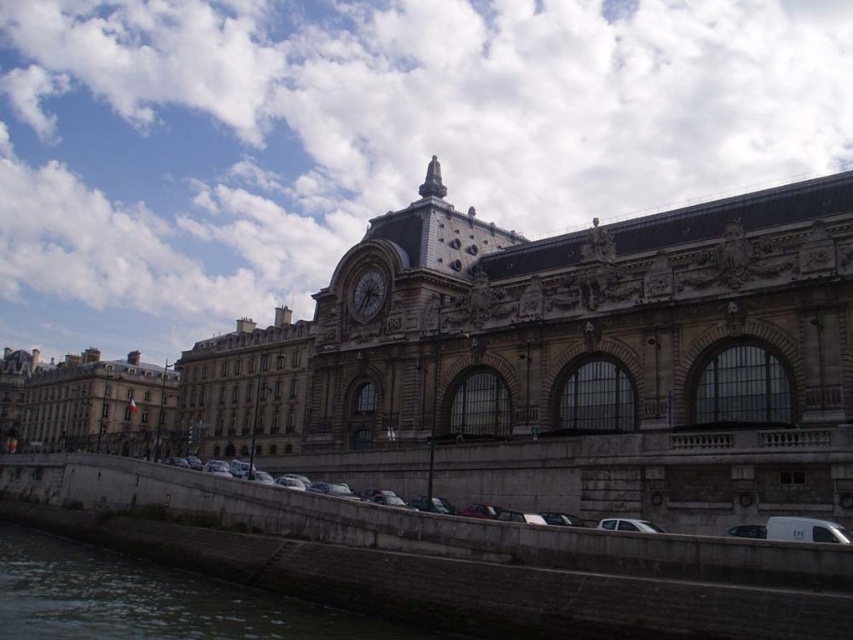
Describe the element at coordinates (548, 332) in the screenshot. I see `stone clock tower at center` at that location.

Is stone clock tower at center to the left of stone building at left from the viewer's perspective?

No, stone clock tower at center is not to the left of stone building at left.

Describe the element at coordinates (548, 332) in the screenshot. I see `stone clock tower at center` at that location.

The image size is (853, 640). I want to click on stone clock tower at center, so click(548, 332).

This screenshot has height=640, width=853. Identify the location of stone building at left. click(x=96, y=404).

Can you confirm if stone building at left is taller than dark gray stone clock at center?

Yes.

Is point (55, 436) positioned after point (366, 307)?

Yes, it is behind point (366, 307).

At what (x,y) coordinates should I click in order to perform the action: click on stone building at left. Please return your answer as a coordinate pair (x, y). Looking at the image, I should click on (96, 404).

Is dark gray concrete at lower left positioned before dark gray stone clock at center?

Yes, dark gray concrete at lower left is in front of dark gray stone clock at center.

Is dark gray concrete at lower left wider than dark gray stone clock at center?

Correct, the width of dark gray concrete at lower left exceeds that of dark gray stone clock at center.

Is point (117, 568) less distant than point (375, 273)?

Yes, point (117, 568) is in front of point (375, 273).

Find the location of a particular element. dark gray concrete at lower left is located at coordinates (154, 600).